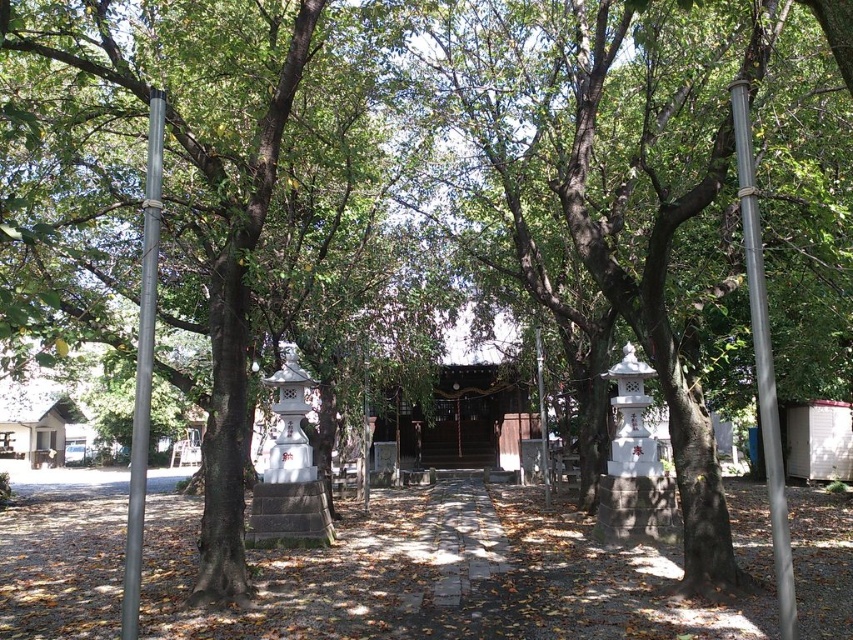
You are standing at the entrance of the shrine and want to locate the metallic pole at left. According to the coordinates provided, where should you look relative to your position?

The metallic pole at left is located at coordinates point (x=143, y=369), which means it is positioned to the left and slightly forward from your current position at the entrance.

You are a visitor at the shrine and want to take a photo of both metallic pole at right and metallic pole at left. Which pole should you stand closer to in order to capture both in the frame without moving your camera?

You should stand closer to the metallic pole at right because it is thinner than the metallic pole at left, allowing both to fit within the camera frame more easily.